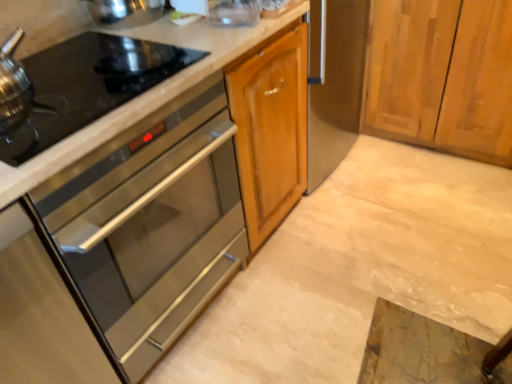
The height and width of the screenshot is (384, 512). Find the location of `blank space situated above black glass gas stove at left (from a real-world perspective)`. blank space situated above black glass gas stove at left (from a real-world perspective) is located at coordinates (68, 76).